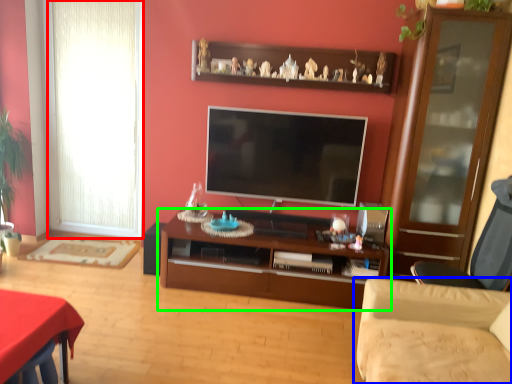
Question: Considering the real-world distances, which object is farthest from window (highlighted by a red box)? studio couch (highlighted by a blue box) or cabinetry (highlighted by a green box)?

Choices:
 (A) studio couch
 (B) cabinetry

Answer: (A)